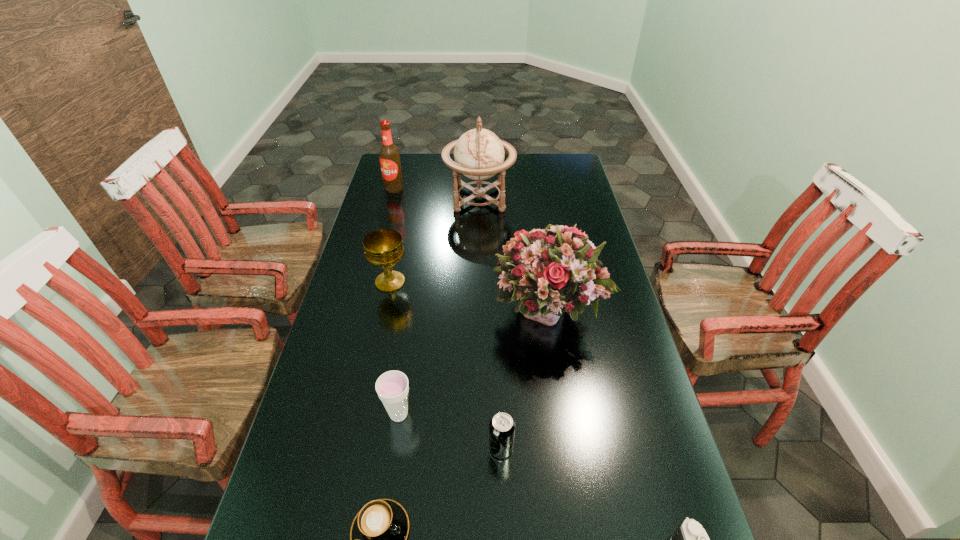
In the image, there is a desktop. Find the location of `vacant space at the far right corner`. vacant space at the far right corner is located at coordinates (571, 162).

I want to click on vacant space that's between the fifth shortest object and the globe, so click(x=435, y=240).

At what (x,y) coordinates should I click in order to perform the action: click on free space between the globe and the soda can. Please return your answer as a coordinate pair (x, y). Looking at the image, I should click on (490, 323).

Find the location of a particular element. The width and height of the screenshot is (960, 540). empty space between the fifth shortest object and the globe is located at coordinates (435, 240).

Locate an element on the screen. Image resolution: width=960 pixels, height=540 pixels. vacant area that lies between the fifth farthest object and the beer bottle is located at coordinates (396, 301).

Identify which object is located as the third nearest to the camera. Please provide its 2D coordinates. Your answer should be formatted as a tuple, i.e. [(x, y)], where the tuple contains the x and y coordinates of a point satisfying the conditions above.

[(378, 534)]

Point out which object is positioned as the third nearest to the globe. Please provide its 2D coordinates. Your answer should be formatted as a tuple, i.e. [(x, y)], where the tuple contains the x and y coordinates of a point satisfying the conditions above.

[(548, 271)]

Where is `vacant region that satisfies the following two spatial constraints: 1. at the front of the globe showing Africa; 2. on the right side of the sixth farthest object`? vacant region that satisfies the following two spatial constraints: 1. at the front of the globe showing Africa; 2. on the right side of the sixth farthest object is located at coordinates [x=479, y=448].

Identify the location of blank area in the image that satisfies the following two spatial constraints: 1. at the front of the bouquet showing Africa; 2. on the left side of the globe. (479, 312).